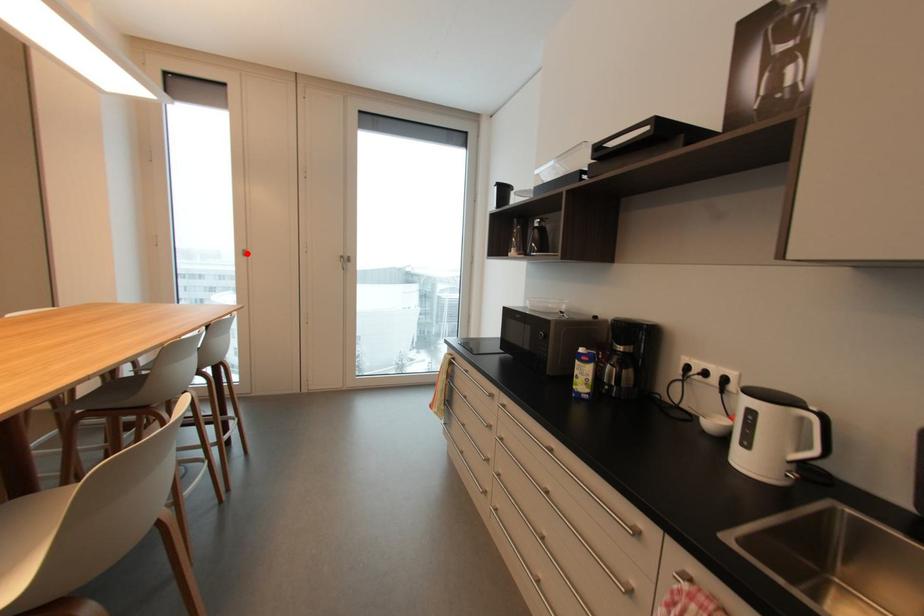
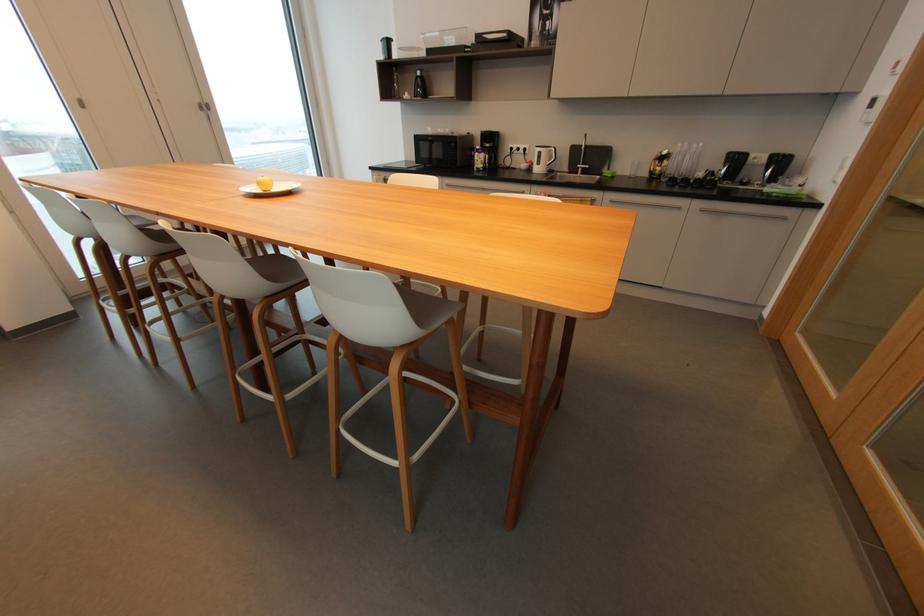
Question: I am providing you with two images of the same scene from different viewpoints. Given a red point in image1, look at the same physical point in image2. Is it:

Choices:
 (A) Closer to the viewpoint
 (B) Farther from the viewpoint

Answer: (A)